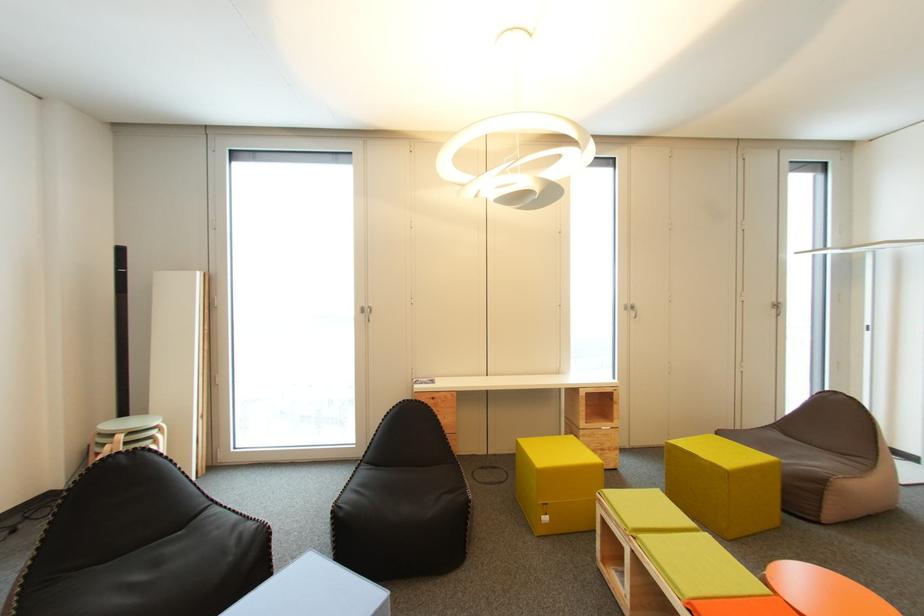
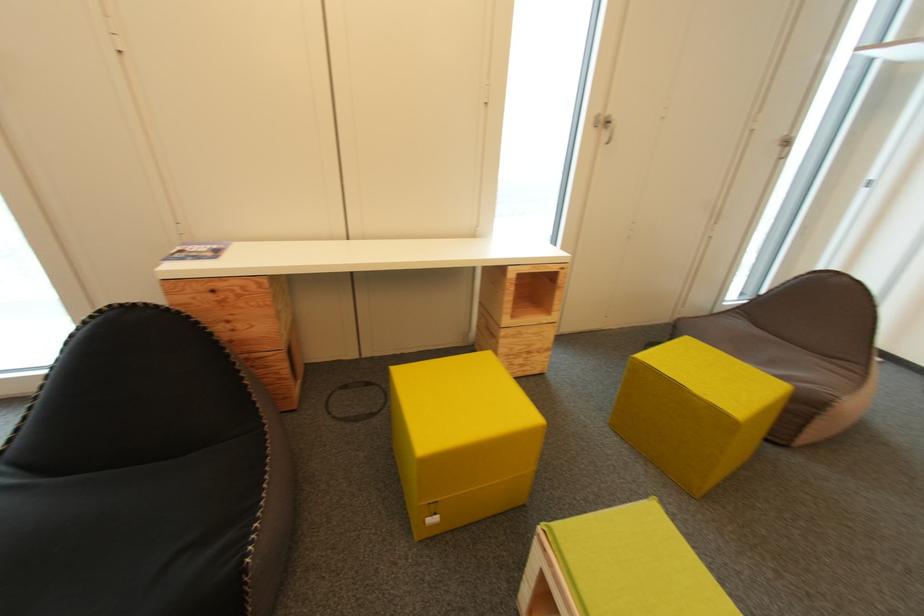
Question: The images are taken continuously from a first-person perspective. In which direction are you moving?

Choices:
 (A) Left
 (B) Right
 (C) Forward
 (D) Backward

Answer: (C)